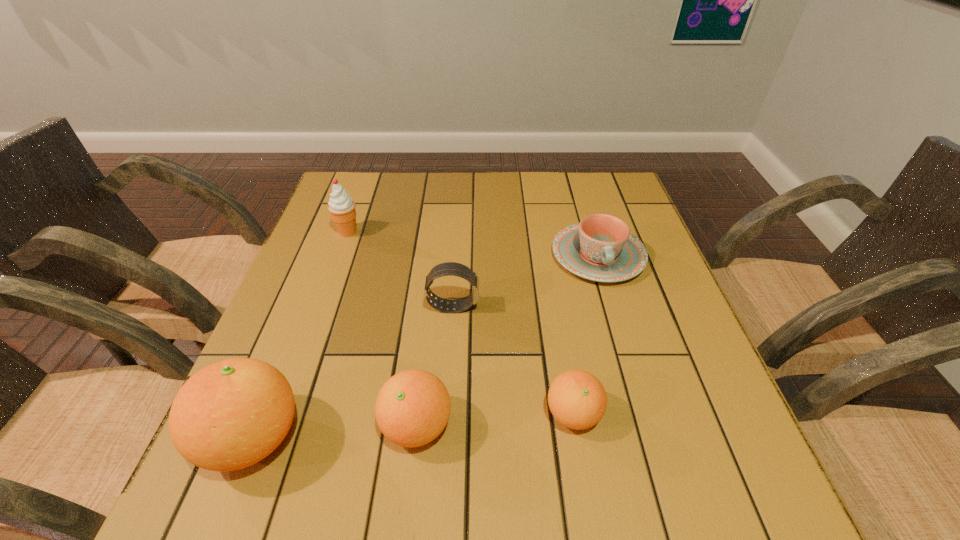
Identify the location of vacant space located on the face of the third farthest object. Image resolution: width=960 pixels, height=540 pixels. pos(555,307).

Where is `vacant region located on the handle side of the chinaware`? vacant region located on the handle side of the chinaware is located at coordinates (644, 408).

Where is `orange that is at the left edge`? This screenshot has height=540, width=960. orange that is at the left edge is located at coordinates (229, 415).

Locate an element on the screen. icecream positioned at the left edge is located at coordinates (341, 206).

The width and height of the screenshot is (960, 540). Identify the location of object that is positioned at the right edge. (600, 248).

What are the coordinates of `object that is at the near left corner` in the screenshot? It's located at (x=229, y=415).

This screenshot has width=960, height=540. I want to click on vacant area at the far edge of the desktop, so click(523, 181).

In the image, there is a desktop. At what (x,y) coordinates should I click in order to perform the action: click on free space at the left edge. Please return your answer as a coordinate pair (x, y). Looking at the image, I should click on (325, 217).

Locate an element on the screen. free space at the right edge of the desktop is located at coordinates (619, 321).

In the image, there is a desktop. Find the location of `vacant space at the far left corner`. vacant space at the far left corner is located at coordinates (339, 173).